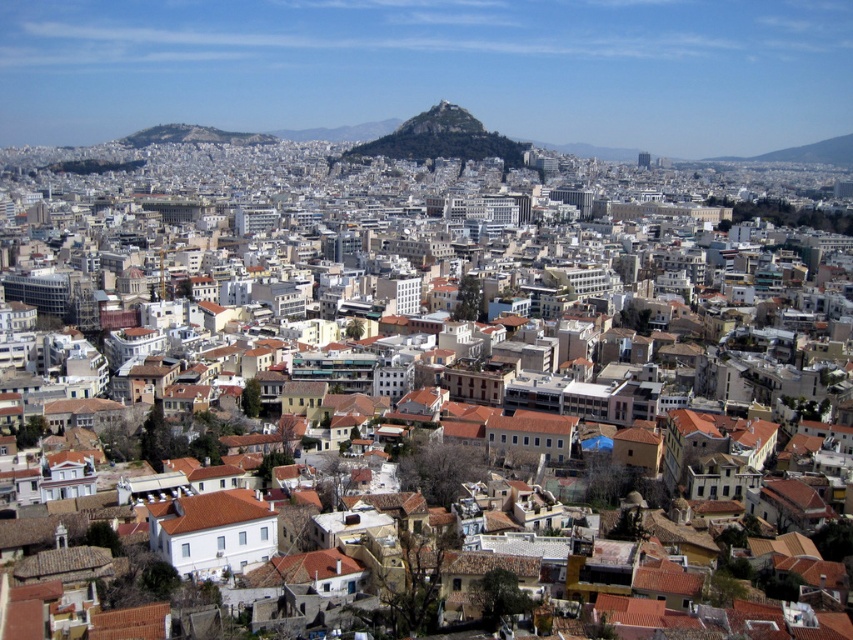
Between point (418, 120) and point (442, 104), which one is positioned in front?

Point (418, 120)

Who is positioned more to the left, green grassy hill at center or green rocky peak at center?

From the viewer's perspective, green grassy hill at center appears more on the left side.

Between point (506, 148) and point (431, 106), which one is positioned behind?

Point (431, 106)

You are a GUI agent. You are given a task and a screenshot of the screen. Output one action in this format:
    pyautogui.click(x=<x>, y=<y>)
    Task: Click on the green grassy hill at center
    The height and width of the screenshot is (640, 853).
    Given the screenshot: What is the action you would take?
    pyautogui.click(x=442, y=138)